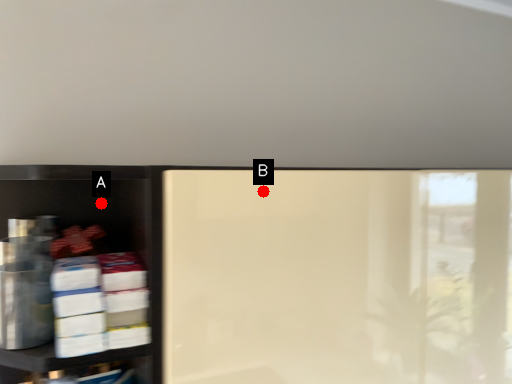
Question: Two points are circled on the image, labeled by A and B beside each circle. Which point is closer to the camera?

Choices:
 (A) A is closer
 (B) B is closer

Answer: (B)